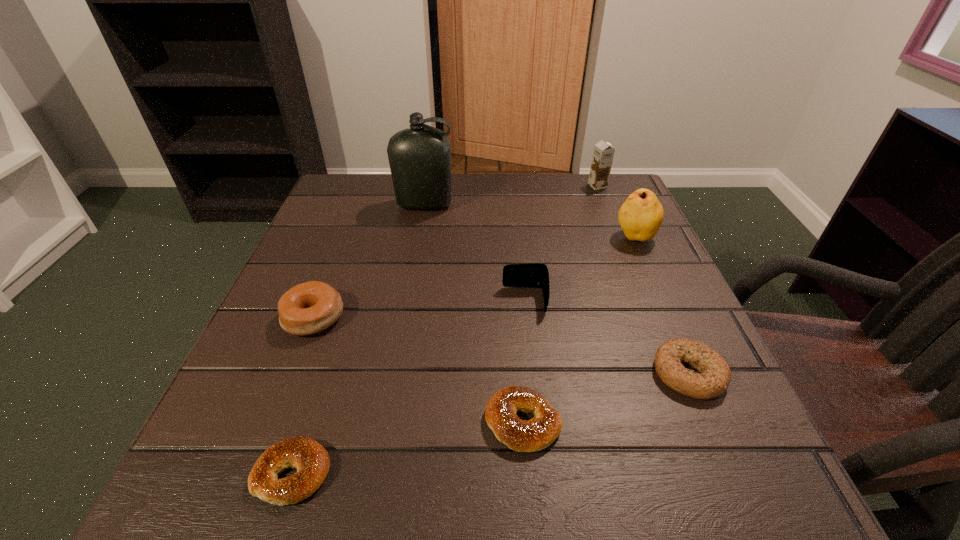
I want to click on free region at the far right corner of the desktop, so click(610, 220).

Where is `vacant space at the near right corner`? vacant space at the near right corner is located at coordinates (667, 448).

The image size is (960, 540). Identify the location of vacant space that's between the sixth nearest object and the third bagel from left to right. (579, 329).

Locate an element on the screen. This screenshot has width=960, height=540. vacant space that's between the tallest object and the rightmost bagel is located at coordinates (557, 289).

I want to click on vacant space that is in between the rightmost bagel and the fourth shortest object, so click(x=501, y=346).

Find the location of a particular element. This screenshot has height=540, width=960. vacant space that is in between the wallet and the farthest bagel is located at coordinates (420, 309).

This screenshot has height=540, width=960. In order to click on free space between the rightmost bagel and the chocolate milk in this screenshot , I will do `click(643, 280)`.

The height and width of the screenshot is (540, 960). I want to click on vacant area that lies between the chocolate milk and the bottle, so click(x=511, y=195).

Where is `object identified as the seventh closest to the rightmost bagel`? object identified as the seventh closest to the rightmost bagel is located at coordinates pos(419,157).

Point out which object is positioned as the third nearest to the rightmost bagel. Please provide its 2D coordinates. Your answer should be formatted as a tuple, i.e. [(x, y)], where the tuple contains the x and y coordinates of a point satisfying the conditions above.

[(641, 215)]